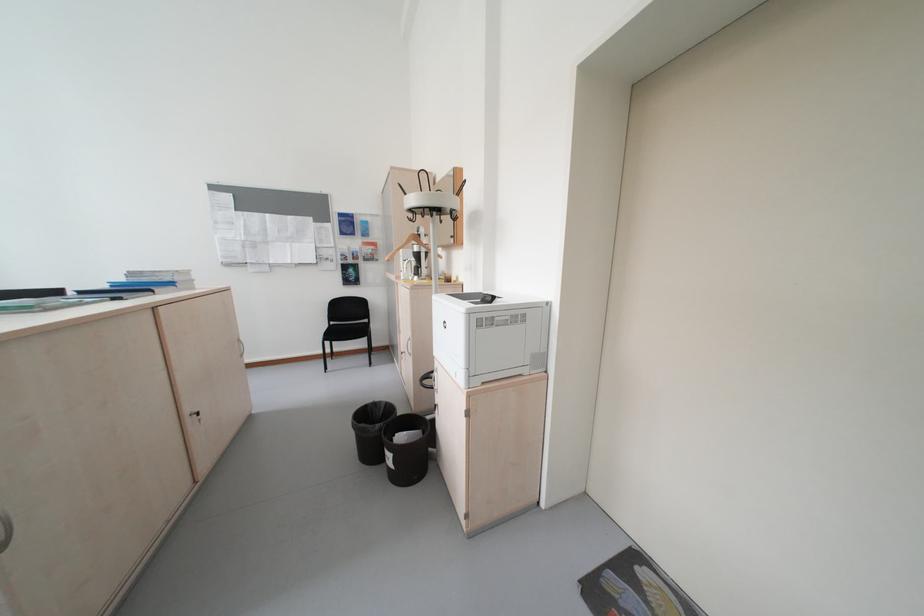
The location [409,246] corresponds to which object?

It refers to a wooden clothes hanger.